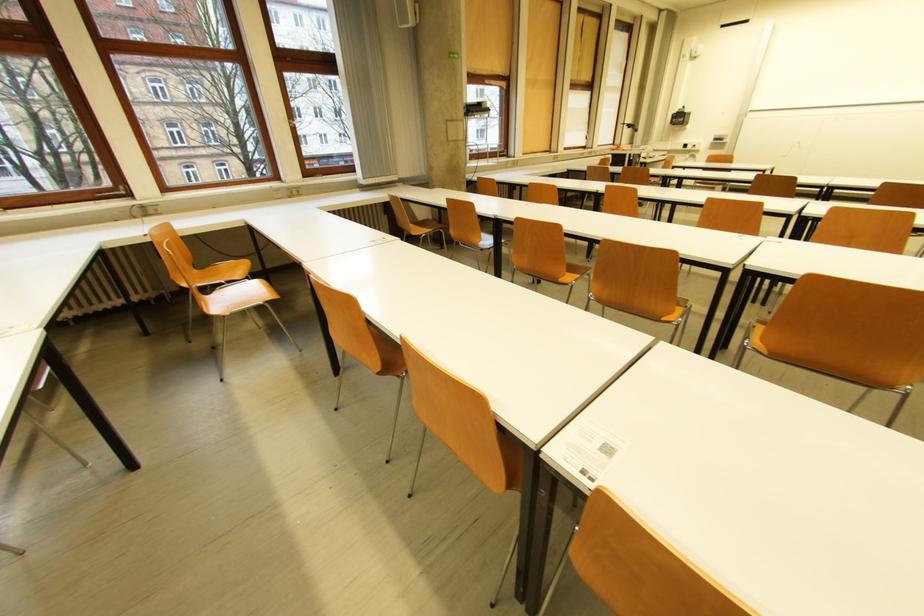
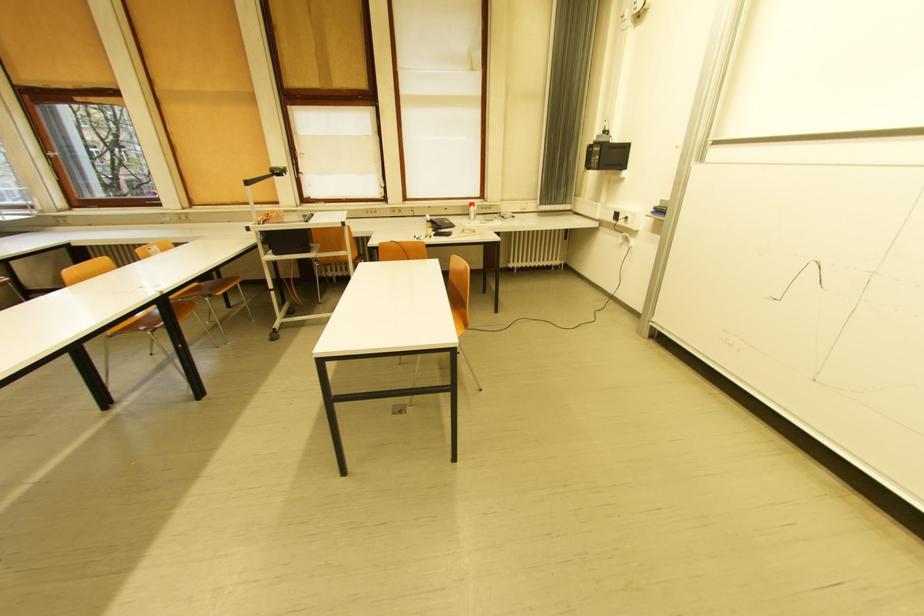
Find the pixel in the second image that matches point (677, 124) in the first image.

(592, 168)